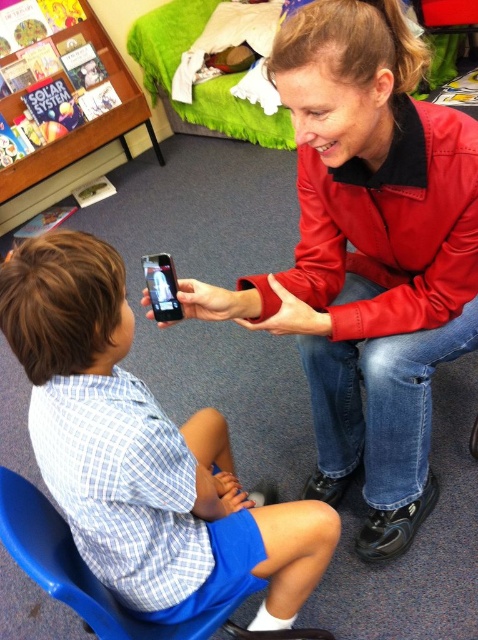
You are a visitor in this room and want to sit next to the person wearing the matte blue shirt at center. Which object should you approach and sit next to the blue plastic chair at lower left?

The matte blue shirt at center is above the blue plastic chair at lower left, so to sit next to the blue plastic chair at lower left, you should approach the blue plastic chair at lower left and sit there since the matte blue shirt at center is positioned above it.